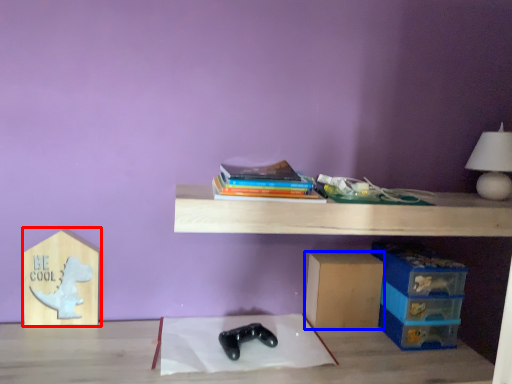
Question: Which of the following is the farthest to the observer, cardboard box (highlighted by a red box) or cardboard box (highlighted by a blue box)?

Choices:
 (A) cardboard box
 (B) cardboard box

Answer: (B)